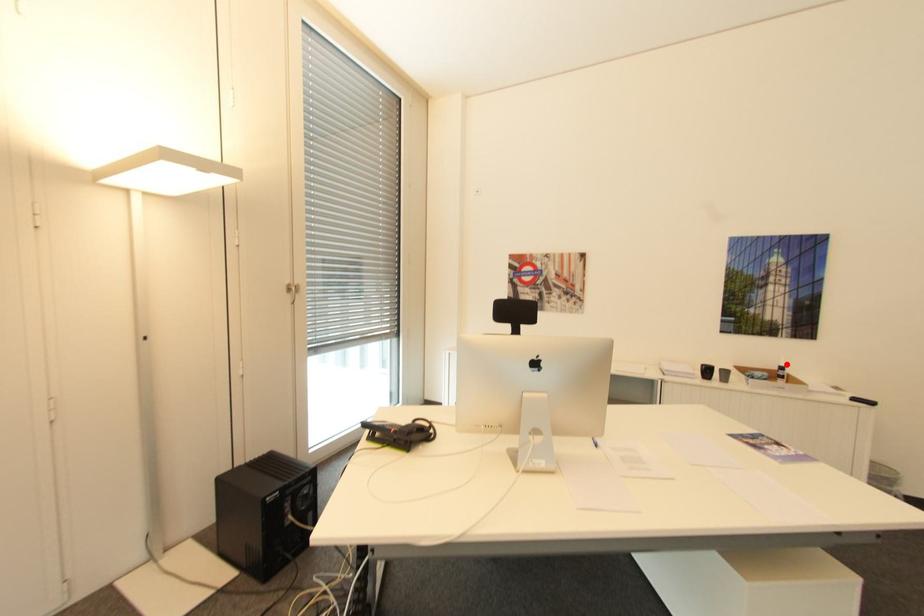
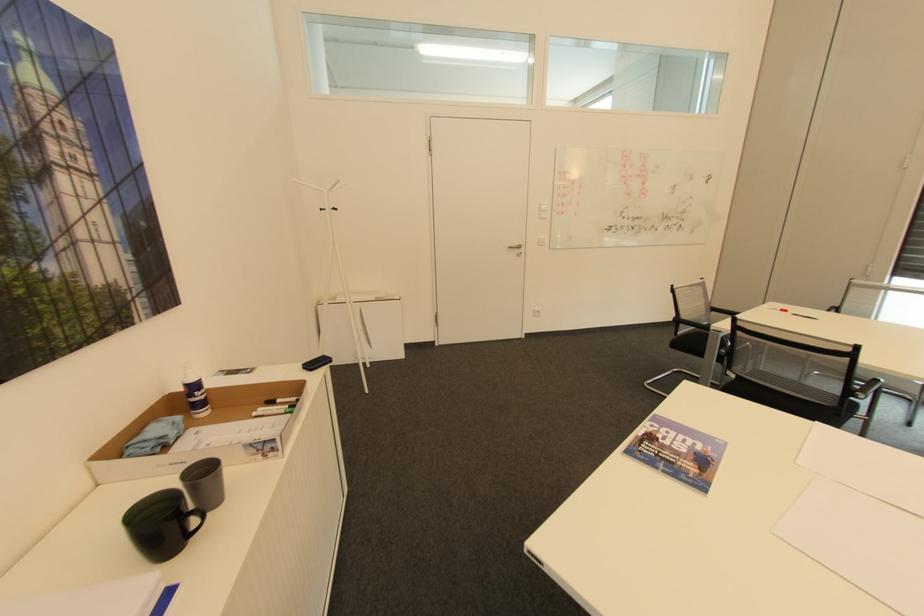
Where in the second image is the point corresponding to the highlighted location from the first image?

(197, 379)